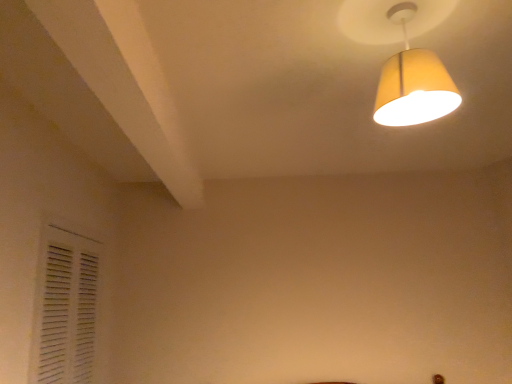
Question: From a real-world perspective, relative to white matte shutter at lower left, is yellow fabric lampshade at upper right vertically above or below?

Choices:
 (A) above
 (B) below

Answer: (A)

Question: Is yellow fabric lampshade at upper right wider or thinner than white matte shutter at lower left?

Choices:
 (A) wide
 (B) thin

Answer: (A)

Question: Based on their positions, is yellow fabric lampshade at upper right located to the left or right of white matte shutter at lower left?

Choices:
 (A) left
 (B) right

Answer: (B)

Question: From a real-world perspective, is white matte shutter at lower left positioned above or below yellow fabric lampshade at upper right?

Choices:
 (A) below
 (B) above

Answer: (A)

Question: Considering their positions, is white matte shutter at lower left located in front of or behind yellow fabric lampshade at upper right?

Choices:
 (A) front
 (B) behind

Answer: (B)

Question: In terms of size, does white matte shutter at lower left appear bigger or smaller than yellow fabric lampshade at upper right?

Choices:
 (A) big
 (B) small

Answer: (A)

Question: Does point (79, 233) appear closer or farther from the camera than point (444, 77)?

Choices:
 (A) farther
 (B) closer

Answer: (A)